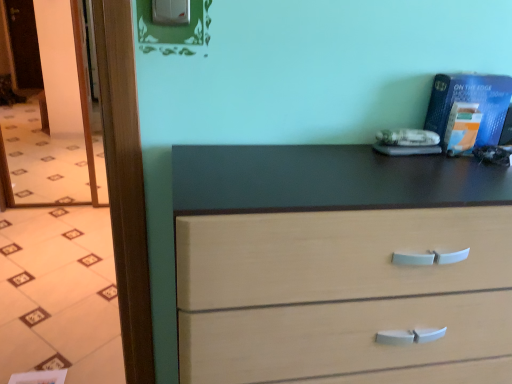
The image size is (512, 384). What do you see at coordinates (338, 264) in the screenshot?
I see `light wood chest of drawers at center` at bounding box center [338, 264].

I want to click on light wood chest of drawers at center, so click(x=338, y=264).

You are a GUI agent. You are given a task and a screenshot of the screen. Output one action in this format:
    pyautogui.click(x=<x>, y=<y>)
    Task: Click on the transparent glass door at left
    The image size is (512, 384).
    Given the screenshot: What is the action you would take?
    pyautogui.click(x=56, y=125)

What do you see at coordinates (56, 125) in the screenshot?
I see `transparent glass door at left` at bounding box center [56, 125].

Measure the distance between transparent glass door at left and camera.

A distance of 9.60 feet exists between transparent glass door at left and camera.

At what (x,y) coordinates should I click in order to perform the action: click on light wood chest of drawers at center. Please return your answer as a coordinate pair (x, y). Looking at the image, I should click on (338, 264).

Considering the relative positions of light wood chest of drawers at center and transparent glass door at left in the image provided, is light wood chest of drawers at center to the right of transparent glass door at left from the viewer's perspective?

Indeed, light wood chest of drawers at center is positioned on the right side of transparent glass door at left.

Between light wood chest of drawers at center and transparent glass door at left, which one is positioned behind?

transparent glass door at left is further from the camera.

Between point (173, 172) and point (65, 184), which one is positioned behind?

Point (65, 184)

From the image's perspective, is light wood chest of drawers at center under transparent glass door at left?

Yes, from the image's perspective, light wood chest of drawers at center is below transparent glass door at left.

From a real-world perspective, between light wood chest of drawers at center and transparent glass door at left, who is vertically higher?

transparent glass door at left is physically above.

Considering the sizes of light wood chest of drawers at center and transparent glass door at left in the image, is light wood chest of drawers at center wider or thinner than transparent glass door at left?

In the image, light wood chest of drawers at center appears to be wider than transparent glass door at left.

Considering the sizes of light wood chest of drawers at center and transparent glass door at left in the image, is light wood chest of drawers at center taller or shorter than transparent glass door at left?

Considering their sizes, light wood chest of drawers at center has less height than transparent glass door at left.

Does light wood chest of drawers at center have a larger size compared to transparent glass door at left?

Yes, light wood chest of drawers at center is bigger than transparent glass door at left.

Is light wood chest of drawers at center completely or partially outside of transparent glass door at left?

Yes, light wood chest of drawers at center is not within transparent glass door at left.

Does light wood chest of drawers at center touch transparent glass door at left?

light wood chest of drawers at center and transparent glass door at left are clearly separated.

Is light wood chest of drawers at center oriented away from transparent glass door at left?

No, light wood chest of drawers at center is not facing away from transparent glass door at left.

Measure the distance from light wood chest of drawers at center to transparent glass door at left.

light wood chest of drawers at center is 2.75 meters away from transparent glass door at left.

Identify the location of glass door above the light wood chest of drawers at center (from the image's perspective). (56, 125).

Which is more to the right, transparent glass door at left or light wood chest of drawers at center?

Positioned to the right is light wood chest of drawers at center.

Is transparent glass door at left closer to camera compared to light wood chest of drawers at center?

That is False.

Does point (72, 181) come farther from viewer compared to point (508, 242)?

Yes, it is behind point (508, 242).

From the image's perspective, is transparent glass door at left positioned above or below light wood chest of drawers at center?

Based on their image positions, transparent glass door at left is located above light wood chest of drawers at center.

From a real-world perspective, between transparent glass door at left and light wood chest of drawers at center, who is vertically higher?

transparent glass door at left, from a real-world perspective.

Considering the relative sizes of transparent glass door at left and light wood chest of drawers at center in the image provided, is transparent glass door at left thinner than light wood chest of drawers at center?

Yes.

Considering the sizes of objects transparent glass door at left and light wood chest of drawers at center in the image provided, who is shorter, transparent glass door at left or light wood chest of drawers at center?

light wood chest of drawers at center.

Who is bigger, transparent glass door at left or light wood chest of drawers at center?

light wood chest of drawers at center.

Is transparent glass door at left inside or outside of light wood chest of drawers at center?

transparent glass door at left exists outside the volume of light wood chest of drawers at center.

Are transparent glass door at left and light wood chest of drawers at center far apart?

Absolutely, transparent glass door at left is distant from light wood chest of drawers at center.

Is transparent glass door at left positioned with its back to light wood chest of drawers at center?

transparent glass door at left is not turned away from light wood chest of drawers at center.

How many degrees apart are the facing directions of transparent glass door at left and light wood chest of drawers at center?

They differ by 0.382 degrees in their facing directions.

In the image, there is a light wood chest of drawers at center. At what (x,y) coordinates should I click in order to perform the action: click on glass door above it (from the image's perspective). Please return your answer as a coordinate pair (x, y). Looking at the image, I should click on (56, 125).

Identify the location of glass door above the light wood chest of drawers at center (from a real-world perspective). (56, 125).

Identify the location of glass door behind the light wood chest of drawers at center. (56, 125).